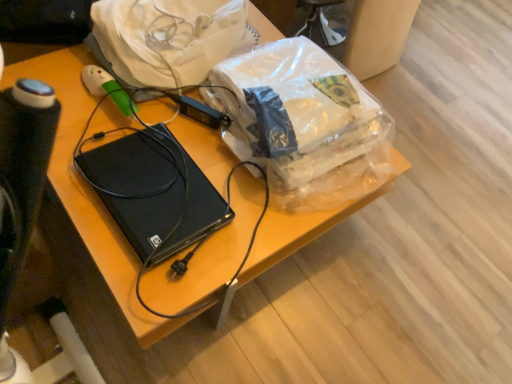
Question: From their relative heights in the image, would you say translucent plastic bag at center is taller or shorter than white plastic bag at upper center?

Choices:
 (A) tall
 (B) short

Answer: (B)

Question: Which is correct: translucent plastic bag at center is inside white plastic bag at upper center, or outside of it?

Choices:
 (A) inside
 (B) outside

Answer: (B)

Question: Which object is positioned closest to the translucent plastic bag at center?

Choices:
 (A) white plastic bag at upper center
 (B) black plastic computer at center

Answer: (A)

Question: Estimate the real-world distances between objects in this image. Which object is farther from the black plastic computer at center?

Choices:
 (A) translucent plastic bag at center
 (B) white plastic bag at upper center

Answer: (B)